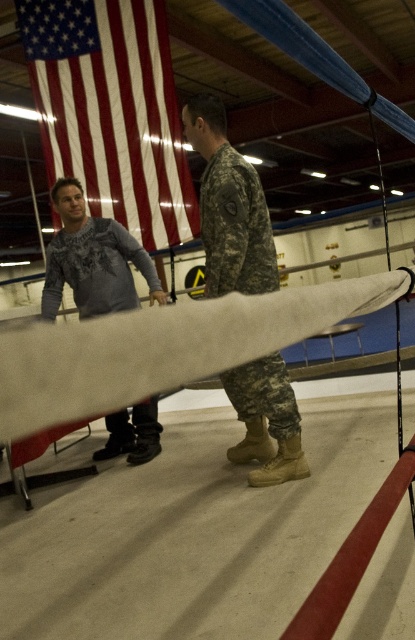
What object is located at the coordinates point (163, 348) in the image?

The white fabric beam at center is located at point (163, 348).